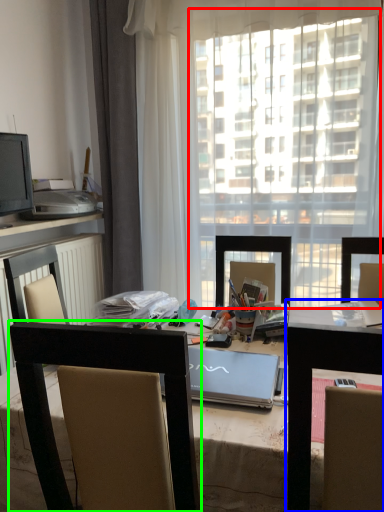
Question: Which object is positioned farthest from window screen (highlighted by a red box)? Select from table (highlighted by a blue box) and chair (highlighted by a green box).

Choices:
 (A) table
 (B) chair

Answer: (B)